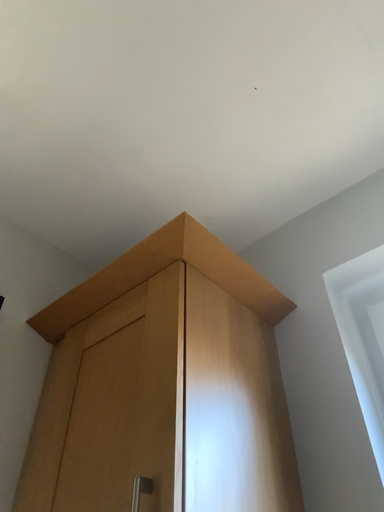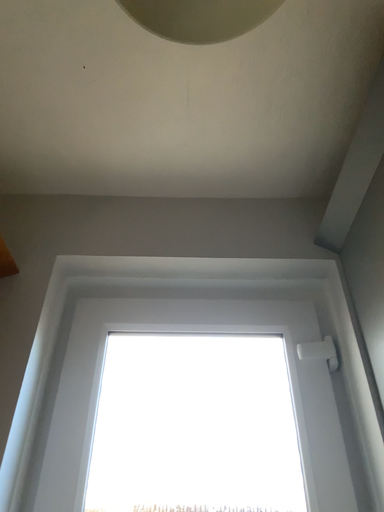
Question: Which way did the camera rotate in the video?

Choices:
 (A) rotated right
 (B) rotated left

Answer: (A)